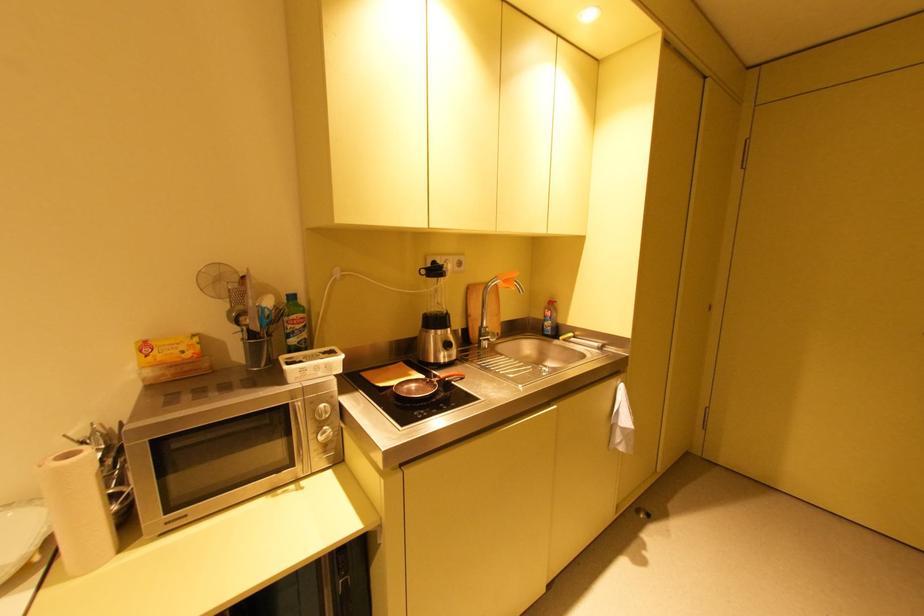
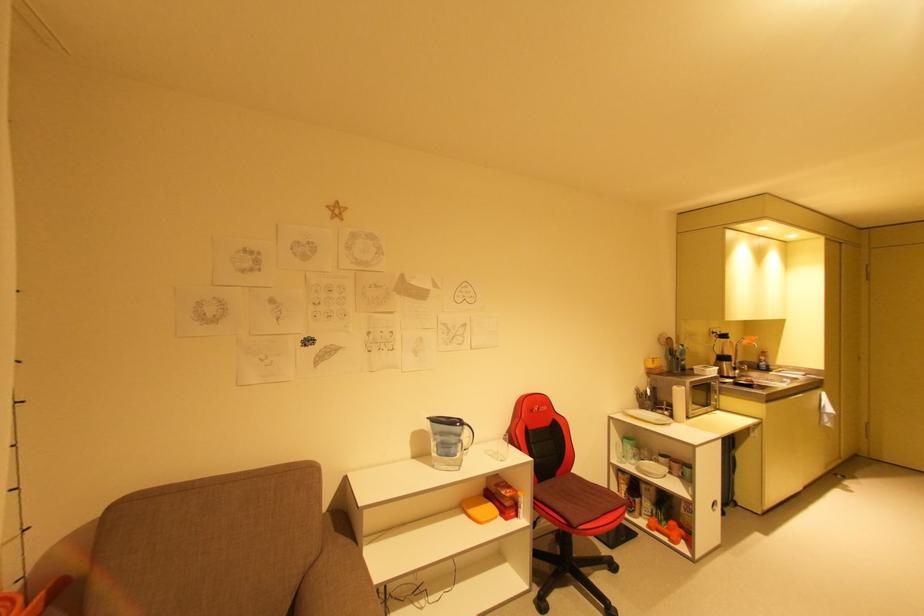
Find the pixel in the second image that matches (x=561, y=342) in the first image.

(776, 373)